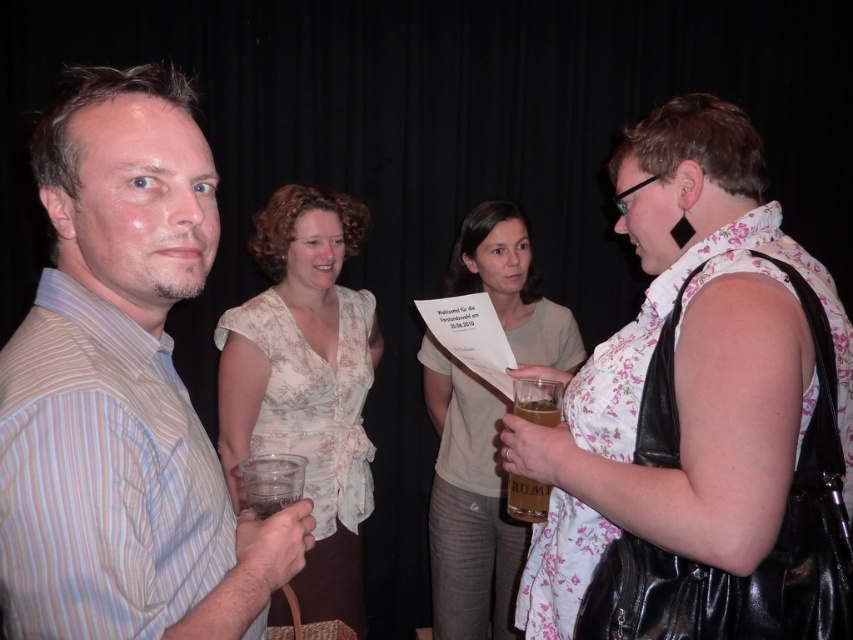
Based on the scene description, which object has a shorter height between the floral fabric dress at center and the white floral blouse at center?

The floral fabric dress at center has a lesser height compared to the white floral blouse at center.

Based on the scene description, where is the white paper at center located in terms of coordinates?

The white paper at center is located at coordinates point (468, 504).